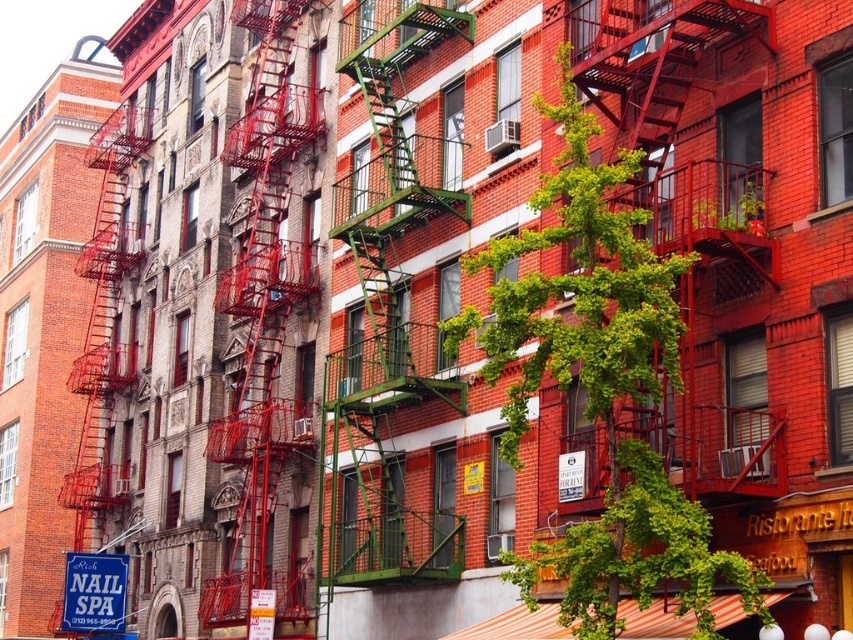
You are a delivery person carrying a package that requires a clear path to the blue plastic sign at lower left. The metallic red fire escape at left is in your way. Can you navigate around it without moving the fire escape?

The metallic red fire escape at left and blue plastic sign at lower left are 12.76 meters apart, so yes, you can navigate around the metallic red fire escape at left to reach the blue plastic sign at lower left as there is sufficient distance between them.

You are a delivery person trying to locate the correct fire escape to reach the third floor of the building. You see both the green metal fire escape at center and the metallic red fire escape at left. Which fire escape is positioned to the right of the other?

The green metal fire escape at center is to the right of the metallic red fire escape at left.

Based on the photo, what are the coordinates of the metallic red fire escape at left?

The metallic red fire escape at left is located at coordinates point [263,321].